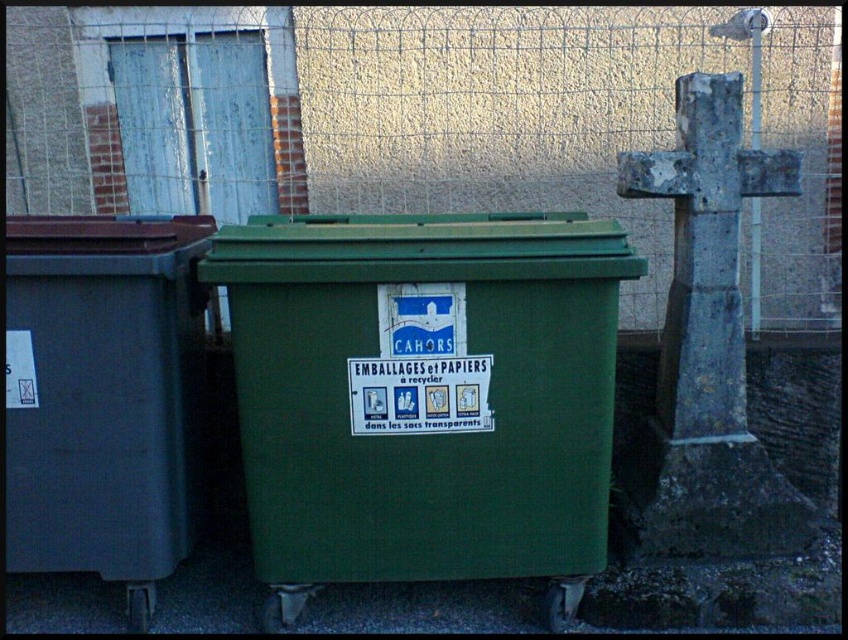
You are standing in front of the green plastic recycling bin at center and the matte gray recycling bin at left. If you want to throw away a transparent bag with recyclables, which bin should you approach first based on their positions?

The green plastic recycling bin at center is closer to the viewer than the matte gray recycling bin at left, so you should approach the green plastic recycling bin at center first.

You are standing in front of two recycling bins. The green plastic recycling bin at center and the matte gray recycling bin at left. Which one is taller?

The matte gray recycling bin at left is taller than the green plastic recycling bin at center.

You are a waste collector who needs to determine which recycling bin to use. You have a bag of recyclables and need to choose between the green plastic recycling bin at center and the matte gray recycling bin at left. Which bin should you use based on their sizes?

Result: The green plastic recycling bin at center is larger in size than the matte gray recycling bin at left, so you should use the green plastic recycling bin at center as it can accommodate more recyclables.